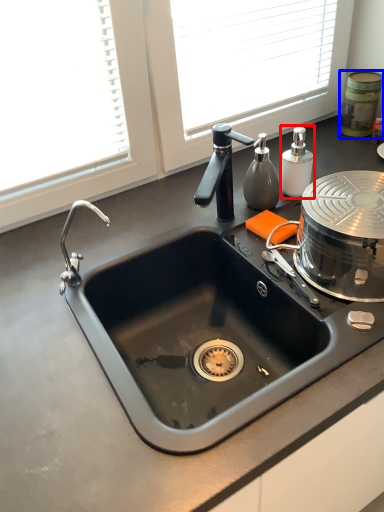
Question: Which object appears farthest to the camera in this image, soap dispenser (highlighted by a red box) or appliance (highlighted by a blue box)?

Choices:
 (A) soap dispenser
 (B) appliance

Answer: (B)